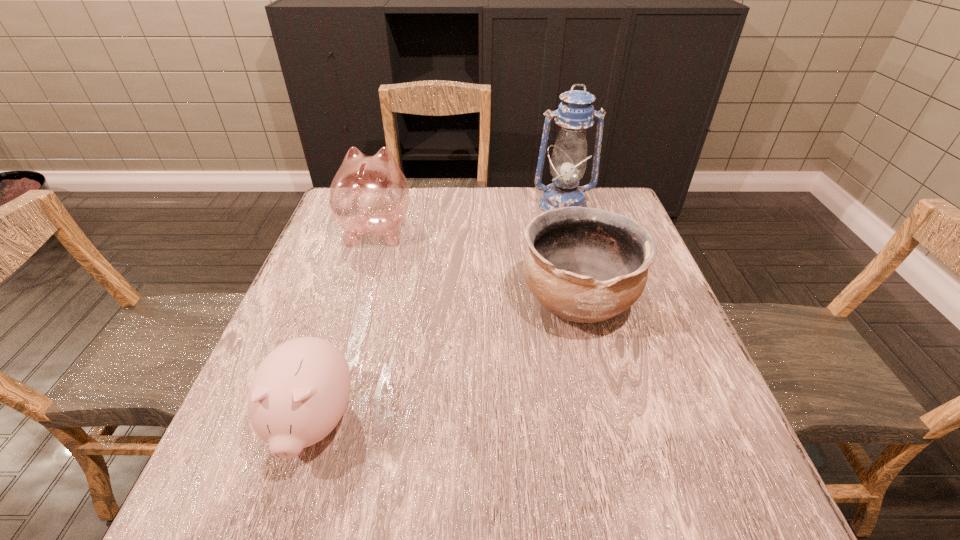
Locate which object ranks third in proximity to the shorter piggy bank. Please provide its 2D coordinates. Your answer should be formatted as a tuple, i.e. [(x, y)], where the tuple contains the x and y coordinates of a point satisfying the conditions above.

[(575, 113)]

Identify which object is the nearest to the farther piggy bank. Please provide its 2D coordinates. Your answer should be formatted as a tuple, i.e. [(x, y)], where the tuple contains the x and y coordinates of a point satisfying the conditions above.

[(587, 265)]